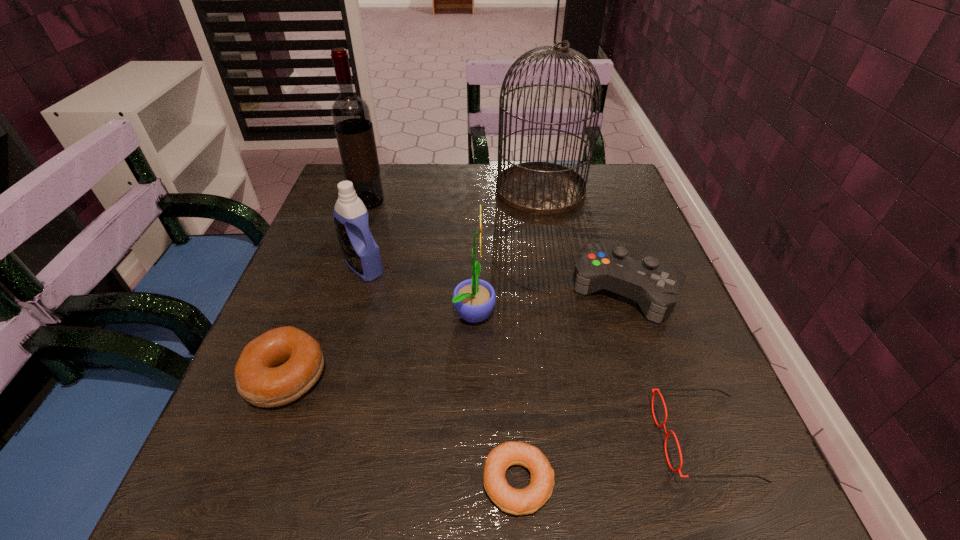
At what (x,y) coordinates should I click in order to perform the action: click on vacant region between the taller bagel and the control. Please return your answer as a coordinate pair (x, y). Looking at the image, I should click on (455, 333).

Identify the location of unoccupied position between the fifth tallest object and the nearer bagel. [x=571, y=386].

Locate an element on the screen. vacant space that's between the detergent and the shorter bagel is located at coordinates (442, 375).

Find the location of `free space that is in between the control and the shorter bagel`. free space that is in between the control and the shorter bagel is located at coordinates (571, 386).

The image size is (960, 540). What are the coordinates of `empty space between the sunflower and the birdcage` in the screenshot? It's located at (508, 251).

What are the coordinates of `vacant space that is in between the control and the seventh tallest object` in the screenshot? It's located at (664, 364).

Image resolution: width=960 pixels, height=540 pixels. I want to click on vacant space that's between the fifth shortest object and the farther bagel, so click(324, 322).

The width and height of the screenshot is (960, 540). In order to click on vacant point located between the birdcage and the sunflower in this screenshot , I will do `click(508, 251)`.

The image size is (960, 540). In order to click on object that is the third closest one to the fifth shortest object in this screenshot , I will do `click(351, 116)`.

This screenshot has height=540, width=960. Identify the location of the fifth closest object to the sunflower. (542, 188).